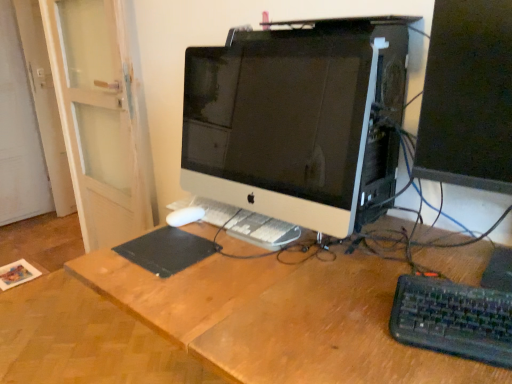
I want to click on free space to the left of matte black monitor at right, the 2th computer monitor from the left, so click(x=379, y=266).